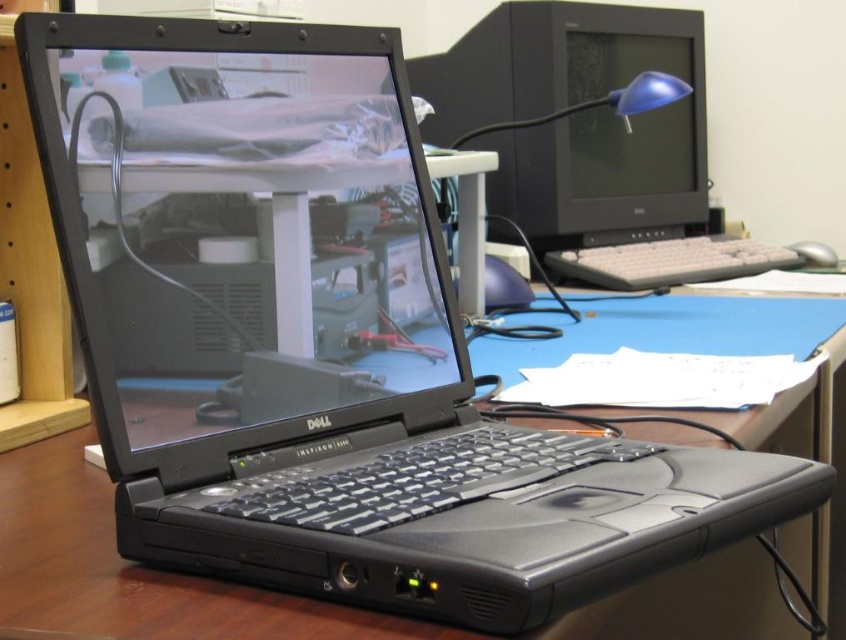
You are setting up a new desk arrangement and need to place a large plant between the matte black monitor at upper right and the white plastic keyboard at center. Considering their sizes, which object should the plant be closer to?

The plant should be closer to the matte black monitor at upper right because it is larger than the white plastic keyboard at center.

You are setting up a new monitor stand and need to know the height difference between the matte black laptop at center and the white plastic keyboard at center. Which one is taller?

The matte black laptop at center is much taller than the white plastic keyboard at center.

You are setting up a new webcam for a video call and need to place it on the tallest object between the matte black monitor at upper right and the silver metallic mouse at right. Which object should you choose?

The matte black monitor at upper right is taller than the silver metallic mouse at right, so you should place the webcam on the matte black monitor at upper right.